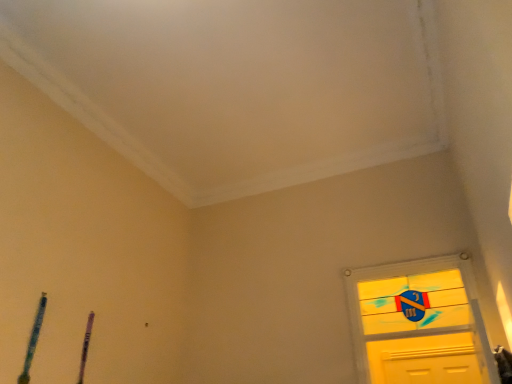
Question: Is purple wood pen at lower left, which is the 2th twin from left to right, in front of or behind blue textured pencil at lower left, the second twin viewed from the right, in the image?

Choices:
 (A) behind
 (B) front

Answer: (A)

Question: Considering the positions of purple wood pen at lower left, acting as the first twin starting from the back, and blue textured pencil at lower left, the first twin from the front, in the image, is purple wood pen at lower left, acting as the first twin starting from the back, bigger or smaller than blue textured pencil at lower left, the first twin from the front,?

Choices:
 (A) big
 (B) small

Answer: (B)

Question: Is purple wood pen at lower left, which appears as the first twin when viewed from the right, taller or shorter than blue textured pencil at lower left, the second twin viewed from the right?

Choices:
 (A) tall
 (B) short

Answer: (B)

Question: Considering the positions of blue textured pencil at lower left, the first twin from the front, and purple wood pen at lower left, which is the 2th twin from left to right, in the image, is blue textured pencil at lower left, the first twin from the front, bigger or smaller than purple wood pen at lower left, which is the 2th twin from left to right,?

Choices:
 (A) big
 (B) small

Answer: (A)

Question: In terms of width, does blue textured pencil at lower left, the second twin positioned from the back, look wider or thinner when compared to purple wood pen at lower left, which ranks as the 2th twin in front-to-back order?

Choices:
 (A) wide
 (B) thin

Answer: (A)

Question: Considering the positions of point (30, 342) and point (86, 327), is point (30, 342) closer or farther from the camera than point (86, 327)?

Choices:
 (A) farther
 (B) closer

Answer: (B)

Question: Visually, is blue textured pencil at lower left, the first twin from the front, positioned to the left or to the right of purple wood pen at lower left, which appears as the first twin when viewed from the right?

Choices:
 (A) right
 (B) left

Answer: (B)